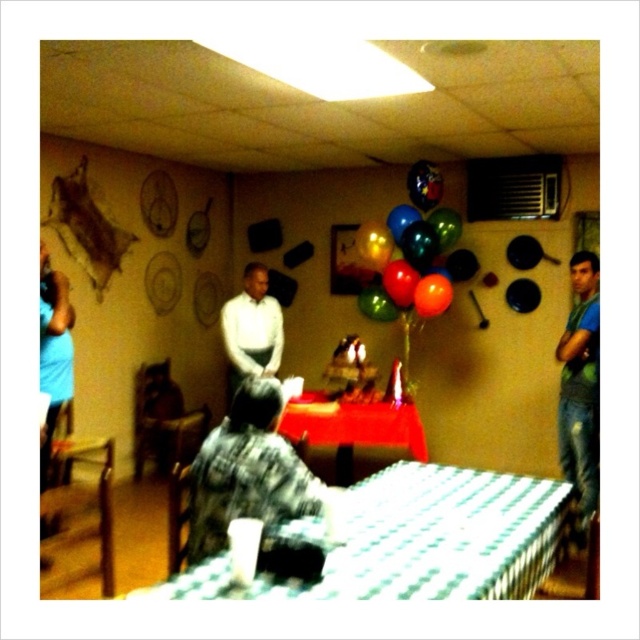
Does point (113, 426) come in front of point (385, 480)?

No, (113, 426) is further to viewer.

Identify the location of multicolored balloons at center. (218, 275).

The image size is (640, 640). In order to click on white checkered tablecloth at lower center in this screenshot , I will do `click(419, 540)`.

Is white checkered tablecloth at lower center positioned before flannel shirt at center?

That is True.

Between point (461, 474) and point (257, 401), which one is positioned behind?

Point (461, 474)

Find the location of a particular element. white checkered tablecloth at lower center is located at coordinates (419, 540).

Who is more forward, [244,378] or [388,296]?

Point [388,296]

From the picture: Is flannel shirt at center to the right of glossy metallic balloons at upper center from the viewer's perspective?

In fact, flannel shirt at center is to the left of glossy metallic balloons at upper center.

I want to click on flannel shirt at center, so click(x=252, y=474).